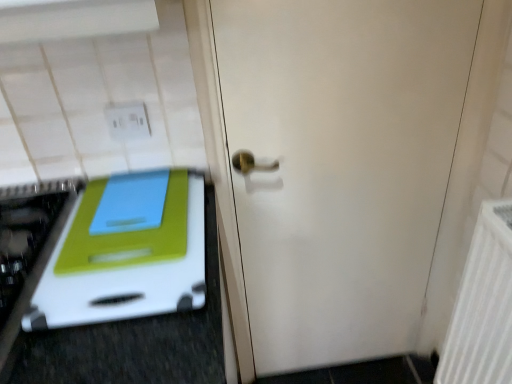
Question: Considering the relative positions of white plastic cutting board at left and white textured radiator at right in the image provided, is white plastic cutting board at left to the right of white textured radiator at right from the viewer's perspective?

Choices:
 (A) no
 (B) yes

Answer: (A)

Question: Considering the relative sizes of white plastic cutting board at left and white textured radiator at right in the image provided, is white plastic cutting board at left smaller than white textured radiator at right?

Choices:
 (A) no
 (B) yes

Answer: (B)

Question: Is white plastic cutting board at left positioned before white textured radiator at right?

Choices:
 (A) no
 (B) yes

Answer: (B)

Question: From a real-world perspective, is white plastic cutting board at left positioned over white textured radiator at right based on gravity?

Choices:
 (A) no
 (B) yes

Answer: (B)

Question: From the image's perspective, is white plastic cutting board at left on top of white textured radiator at right?

Choices:
 (A) yes
 (B) no

Answer: (A)

Question: Is white plastic cutting board at left touching white textured radiator at right?

Choices:
 (A) no
 (B) yes

Answer: (A)

Question: Can you confirm if white textured radiator at right is smaller than white matte door at center?

Choices:
 (A) no
 (B) yes

Answer: (B)

Question: Is the surface of white textured radiator at right in direct contact with white matte door at center?

Choices:
 (A) no
 (B) yes

Answer: (A)

Question: Is white textured radiator at right facing towards white matte door at center?

Choices:
 (A) yes
 (B) no

Answer: (B)

Question: Could white matte door at center be considered to be inside white textured radiator at right?

Choices:
 (A) no
 (B) yes

Answer: (A)

Question: From the image's perspective, is white textured radiator at right beneath white matte door at center?

Choices:
 (A) yes
 (B) no

Answer: (A)

Question: Is white textured radiator at right wider than white matte door at center?

Choices:
 (A) no
 (B) yes

Answer: (B)

Question: Considering the relative sizes of white matte door at center and white textured radiator at right in the image provided, is white matte door at center bigger than white textured radiator at right?

Choices:
 (A) yes
 (B) no

Answer: (A)